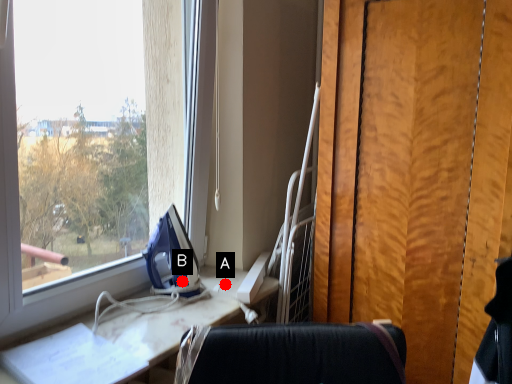
Question: Two points are circled on the image, labeled by A and B beside each circle. Which point appears closest to the camera in this image?

Choices:
 (A) A is closer
 (B) B is closer

Answer: (B)